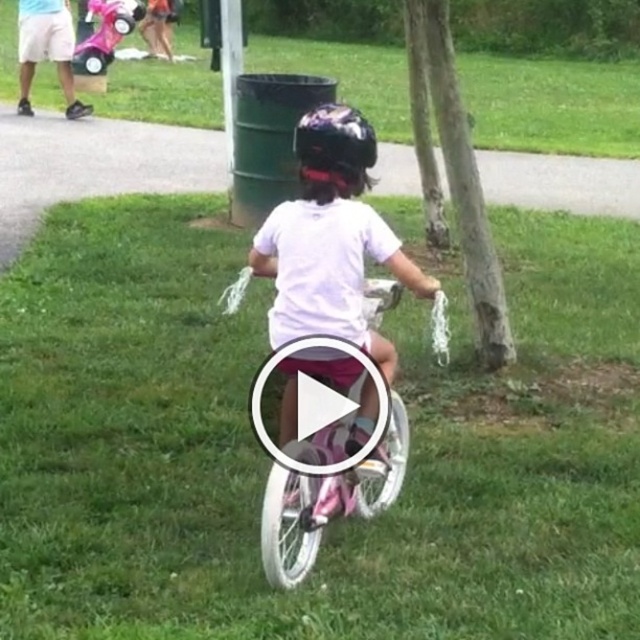
Question: Is pink metallic bicycle at center positioned in front of pink plastic tricycle at upper left?

Choices:
 (A) no
 (B) yes

Answer: (B)

Question: Observing the image, what is the correct spatial positioning of brown rough tree at center in reference to shiny purple helmet at center?

Choices:
 (A) right
 (B) left

Answer: (A)

Question: Which object appears closest to the camera in this image?

Choices:
 (A) green grass at center
 (B) brown rough tree at center

Answer: (A)

Question: Estimate the real-world distances between objects in this image. Which object is farther from the shiny purple helmet at center?

Choices:
 (A) green grass at center
 (B) pink metallic bicycle at center

Answer: (A)

Question: Which point is closer to the camera taking this photo?

Choices:
 (A) (88, 3)
 (B) (406, 438)
 (C) (484, 228)

Answer: (B)

Question: Where is green grass at center located in relation to brown rough tree at center in the image?

Choices:
 (A) above
 (B) below

Answer: (B)